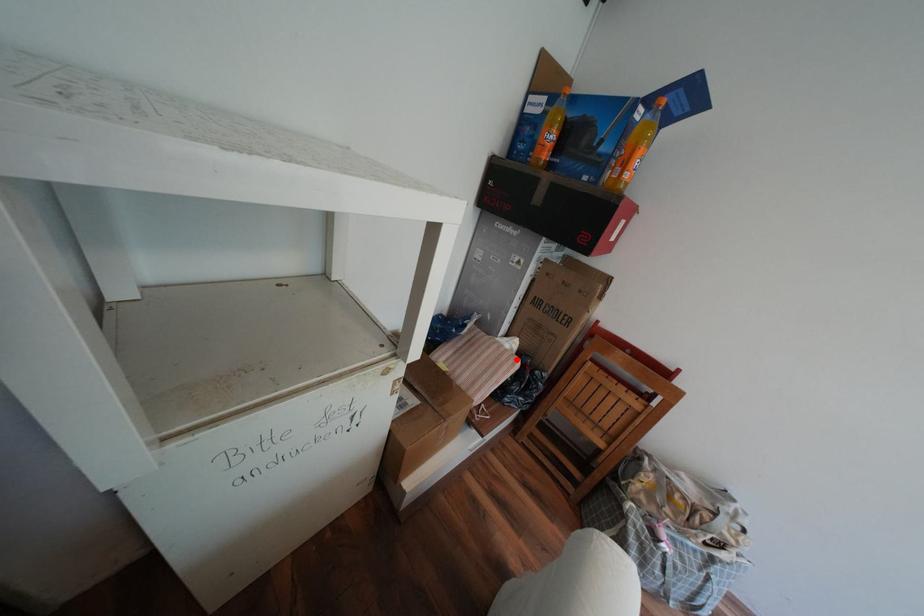
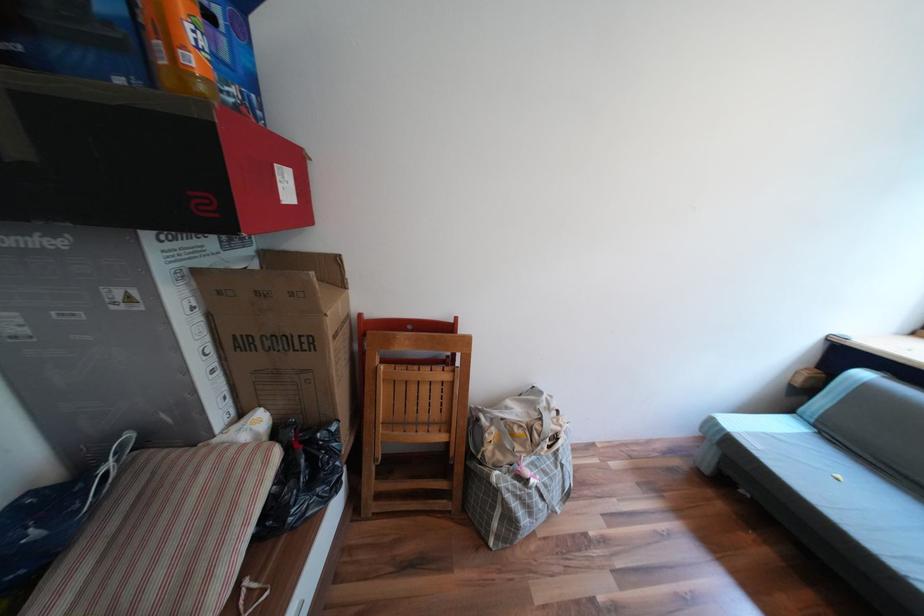
Where in the second image is the point corresponding to the highlighted location from the first image?

(258, 464)